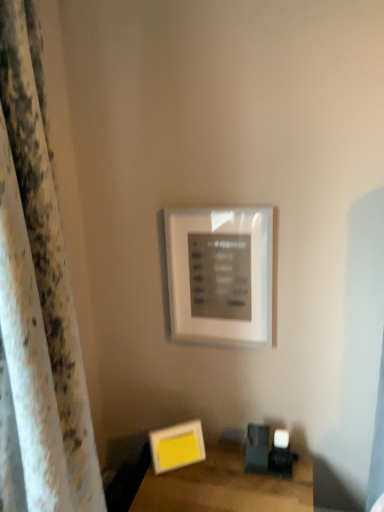
Measure the distance between wooden table at lower right and camera.

wooden table at lower right is 3.83 feet from camera.

Measure the distance between yellow matte picture frame at lower center, the 1th picture frame from the bottom, and camera.

yellow matte picture frame at lower center, the 1th picture frame from the bottom, is 4.30 feet from camera.

Describe the element at coordinates (220, 275) in the screenshot. I see `white matte picture frame at upper center, which appears as the 2th picture frame when ordered from the bottom` at that location.

Find the location of a particular element. wooden table at lower right is located at coordinates (225, 486).

Is wooden table at lower right inside or outside of yellow matte picture frame at lower center, marked as the second picture frame in a top-to-bottom arrangement?

wooden table at lower right is not enclosed by yellow matte picture frame at lower center, marked as the second picture frame in a top-to-bottom arrangement.

How many degrees apart are the facing directions of wooden table at lower right and yellow matte picture frame at lower center, the 1th picture frame from the bottom?

The facing directions of wooden table at lower right and yellow matte picture frame at lower center, the 1th picture frame from the bottom, are 33.8 degrees apart.

From a real-world perspective, does wooden table at lower right stand above yellow matte picture frame at lower center, the 1th picture frame from the bottom?

Incorrect, from a real-world perspective, wooden table at lower right is lower than yellow matte picture frame at lower center, the 1th picture frame from the bottom.

In terms of width, does wooden table at lower right look wider or thinner when compared to yellow matte picture frame at lower center, the 1th picture frame from the bottom?

wooden table at lower right is wider than yellow matte picture frame at lower center, the 1th picture frame from the bottom.

I want to click on curtain that is above the wooden table at lower right (from the image's perspective), so click(39, 298).

Does wooden table at lower right appear on the right side of white textured curtain at left?

Yes.

From a real-world perspective, between wooden table at lower right and white textured curtain at left, who is vertically higher?

From a 3D spatial view, white textured curtain at left is above.

Between wooden table at lower right and white textured curtain at left, which one has smaller width?

With smaller width is white textured curtain at left.

Is point (59, 403) closer or farther from the camera than point (215, 305)?

Point (59, 403) is closer to the camera than point (215, 305).

Measure the distance between white textured curtain at left and white matte picture frame at upper center, placed as the first picture frame when sorted from top to bottom.

white textured curtain at left is 22.72 inches from white matte picture frame at upper center, placed as the first picture frame when sorted from top to bottom.

Is white textured curtain at left in front of or behind white matte picture frame at upper center, which appears as the 2th picture frame when ordered from the bottom, in the image?

Visually, white textured curtain at left is located in front of white matte picture frame at upper center, which appears as the 2th picture frame when ordered from the bottom.

Is white textured curtain at left turned away from white matte picture frame at upper center, placed as the first picture frame when sorted from top to bottom?

No, white matte picture frame at upper center, placed as the first picture frame when sorted from top to bottom, is not at the back of white textured curtain at left.

From a real-world perspective, is yellow matte picture frame at lower center, the 1th picture frame from the bottom, positioned above or below wooden table at lower right?

yellow matte picture frame at lower center, the 1th picture frame from the bottom, is above wooden table at lower right.

Can you tell me how much yellow matte picture frame at lower center, marked as the second picture frame in a top-to-bottom arrangement, and wooden table at lower right differ in facing direction?

They differ by 33.8 degrees in their facing directions.

Looking at this image, is yellow matte picture frame at lower center, marked as the second picture frame in a top-to-bottom arrangement, in front of or behind wooden table at lower right in the image?

Clearly, yellow matte picture frame at lower center, marked as the second picture frame in a top-to-bottom arrangement, is behind wooden table at lower right.

Does yellow matte picture frame at lower center, marked as the second picture frame in a top-to-bottom arrangement, have a smaller size compared to wooden table at lower right?

Yes.

Measure the distance from white matte picture frame at upper center, placed as the first picture frame when sorted from top to bottom, to wooden table at lower right.

white matte picture frame at upper center, placed as the first picture frame when sorted from top to bottom, and wooden table at lower right are 20.20 inches apart from each other.

From a real-world perspective, starting from the wooden table at lower right, which picture frame is the 2nd one vertically above it? Please provide its 2D coordinates.

[(220, 275)]

What's the angular difference between white matte picture frame at upper center, which appears as the 2th picture frame when ordered from the bottom, and wooden table at lower right's facing directions?

white matte picture frame at upper center, which appears as the 2th picture frame when ordered from the bottom, and wooden table at lower right are facing 0.0337 degrees away from each other.

Relative to wooden table at lower right, is white matte picture frame at upper center, which appears as the 2th picture frame when ordered from the bottom, in front or behind?

In the image, white matte picture frame at upper center, which appears as the 2th picture frame when ordered from the bottom, appears behind wooden table at lower right.

Is white matte picture frame at upper center, which appears as the 2th picture frame when ordered from the bottom, smaller than white textured curtain at left?

Correct, white matte picture frame at upper center, which appears as the 2th picture frame when ordered from the bottom, occupies less space than white textured curtain at left.

Is white matte picture frame at upper center, placed as the first picture frame when sorted from top to bottom, to the left of white textured curtain at left from the viewer's perspective?

No, white matte picture frame at upper center, placed as the first picture frame when sorted from top to bottom, is not to the left of white textured curtain at left.

Considering the sizes of objects white matte picture frame at upper center, which appears as the 2th picture frame when ordered from the bottom, and white textured curtain at left in the image provided, who is thinner, white matte picture frame at upper center, which appears as the 2th picture frame when ordered from the bottom, or white textured curtain at left?

With smaller width is white matte picture frame at upper center, which appears as the 2th picture frame when ordered from the bottom.

How many degrees apart are the facing directions of white matte picture frame at upper center, placed as the first picture frame when sorted from top to bottom, and white textured curtain at left?

The facing directions of white matte picture frame at upper center, placed as the first picture frame when sorted from top to bottom, and white textured curtain at left are 90 degrees apart.

Is point (205, 251) positioned behind point (187, 454)?

No, it is not.

Is white matte picture frame at upper center, placed as the first picture frame when sorted from top to bottom, to the left of yellow matte picture frame at lower center, marked as the second picture frame in a top-to-bottom arrangement, from the viewer's perspective?

No, white matte picture frame at upper center, placed as the first picture frame when sorted from top to bottom, is not to the left of yellow matte picture frame at lower center, marked as the second picture frame in a top-to-bottom arrangement.

Which of these two, white matte picture frame at upper center, placed as the first picture frame when sorted from top to bottom, or yellow matte picture frame at lower center, marked as the second picture frame in a top-to-bottom arrangement, is bigger?

white matte picture frame at upper center, placed as the first picture frame when sorted from top to bottom, is bigger.

Is white matte picture frame at upper center, placed as the first picture frame when sorted from top to bottom, taller or shorter than yellow matte picture frame at lower center, marked as the second picture frame in a top-to-bottom arrangement?

white matte picture frame at upper center, placed as the first picture frame when sorted from top to bottom, is taller than yellow matte picture frame at lower center, marked as the second picture frame in a top-to-bottom arrangement.

The height and width of the screenshot is (512, 384). Find the location of `the 1st picture frame above when counting from the wooden table at lower right (from the image's perspective)`. the 1st picture frame above when counting from the wooden table at lower right (from the image's perspective) is located at coordinates (177, 446).

At what (x,y) coordinates should I click in order to perform the action: click on curtain lying in front of the wooden table at lower right. Please return your answer as a coordinate pair (x, y). This screenshot has width=384, height=512. Looking at the image, I should click on (39, 298).

Considering their positions, is white matte picture frame at upper center, which appears as the 2th picture frame when ordered from the bottom, positioned closer to white textured curtain at left than wooden table at lower right?

Among the two, wooden table at lower right is located nearer to white textured curtain at left.

Considering their positions, is wooden table at lower right positioned closer to white matte picture frame at upper center, which appears as the 2th picture frame when ordered from the bottom, than yellow matte picture frame at lower center, the 1th picture frame from the bottom?

yellow matte picture frame at lower center, the 1th picture frame from the bottom, is positioned closer to the anchor white matte picture frame at upper center, which appears as the 2th picture frame when ordered from the bottom.

From the image, which object appears to be farther from white textured curtain at left, yellow matte picture frame at lower center, marked as the second picture frame in a top-to-bottom arrangement, or wooden table at lower right?

Among the two, yellow matte picture frame at lower center, marked as the second picture frame in a top-to-bottom arrangement, is located further to white textured curtain at left.

Based on their spatial positions, is yellow matte picture frame at lower center, marked as the second picture frame in a top-to-bottom arrangement, or white matte picture frame at upper center, placed as the first picture frame when sorted from top to bottom, closer to wooden table at lower right?

yellow matte picture frame at lower center, marked as the second picture frame in a top-to-bottom arrangement, is positioned closer to the anchor wooden table at lower right.

When comparing their distances from white textured curtain at left, does wooden table at lower right or white matte picture frame at upper center, which appears as the 2th picture frame when ordered from the bottom, seem further?

white matte picture frame at upper center, which appears as the 2th picture frame when ordered from the bottom, is positioned further to the anchor white textured curtain at left.

From the image, which object appears to be farther from yellow matte picture frame at lower center, the 1th picture frame from the bottom, white matte picture frame at upper center, placed as the first picture frame when sorted from top to bottom, or white textured curtain at left?

white textured curtain at left is further to yellow matte picture frame at lower center, the 1th picture frame from the bottom.

Based on their spatial positions, is white textured curtain at left or wooden table at lower right closer to white matte picture frame at upper center, which appears as the 2th picture frame when ordered from the bottom?

wooden table at lower right.

Which object lies nearer to the anchor point white matte picture frame at upper center, placed as the first picture frame when sorted from top to bottom, wooden table at lower right or white textured curtain at left?

wooden table at lower right.

I want to click on picture frame between white matte picture frame at upper center, placed as the first picture frame when sorted from top to bottom, and wooden table at lower right from top to bottom, so click(x=177, y=446).

Where is `table between white textured curtain at left and yellow matte picture frame at lower center, marked as the second picture frame in a top-to-bottom arrangement, along the z-axis`? The width and height of the screenshot is (384, 512). table between white textured curtain at left and yellow matte picture frame at lower center, marked as the second picture frame in a top-to-bottom arrangement, along the z-axis is located at coordinates (225, 486).

Where is `curtain that lies between white matte picture frame at upper center, placed as the first picture frame when sorted from top to bottom, and wooden table at lower right from top to bottom`? This screenshot has width=384, height=512. curtain that lies between white matte picture frame at upper center, placed as the first picture frame when sorted from top to bottom, and wooden table at lower right from top to bottom is located at coordinates (39, 298).

Image resolution: width=384 pixels, height=512 pixels. In order to click on picture frame between white textured curtain at left and yellow matte picture frame at lower center, marked as the second picture frame in a top-to-bottom arrangement, along the z-axis in this screenshot , I will do `click(220, 275)`.